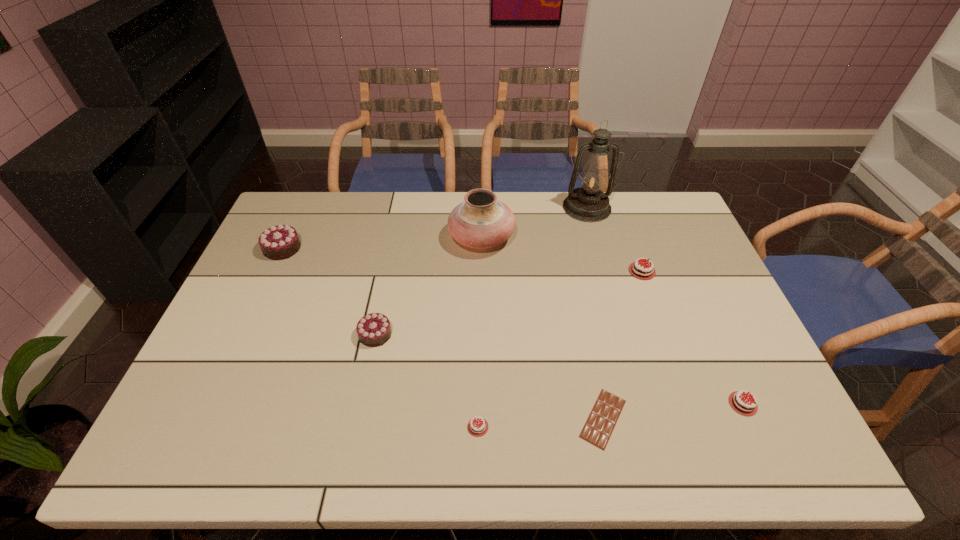
The height and width of the screenshot is (540, 960). Find the location of `the tallest object`. the tallest object is located at coordinates (588, 203).

Locate an element on the screen. The height and width of the screenshot is (540, 960). pottery is located at coordinates (481, 221).

Locate an element on the screen. the third tallest object is located at coordinates tap(279, 242).

At what (x,y) coordinates should I click in order to perform the action: click on the bigger chocolate chocolate cake. Please return your answer as a coordinate pair (x, y). Looking at the image, I should click on (279, 242).

Find the location of a particular element. the right chocolate chocolate cake is located at coordinates (374, 329).

You are a GUI agent. You are given a task and a screenshot of the screen. Output one action in this format:
    pyautogui.click(x=<x>, y=<y>)
    Task: Click on the fifth shortest object
    
    Given the screenshot: What is the action you would take?
    pyautogui.click(x=374, y=329)

This screenshot has width=960, height=540. I want to click on the third shortest chocolate cake, so pyautogui.click(x=640, y=271).

The height and width of the screenshot is (540, 960). I want to click on the farthest red chocolate cake, so click(640, 271).

The width and height of the screenshot is (960, 540). Identify the location of the sixth tallest object. (741, 404).

Locate an element on the screen. This screenshot has height=540, width=960. the fourth tallest chocolate cake is located at coordinates (741, 404).